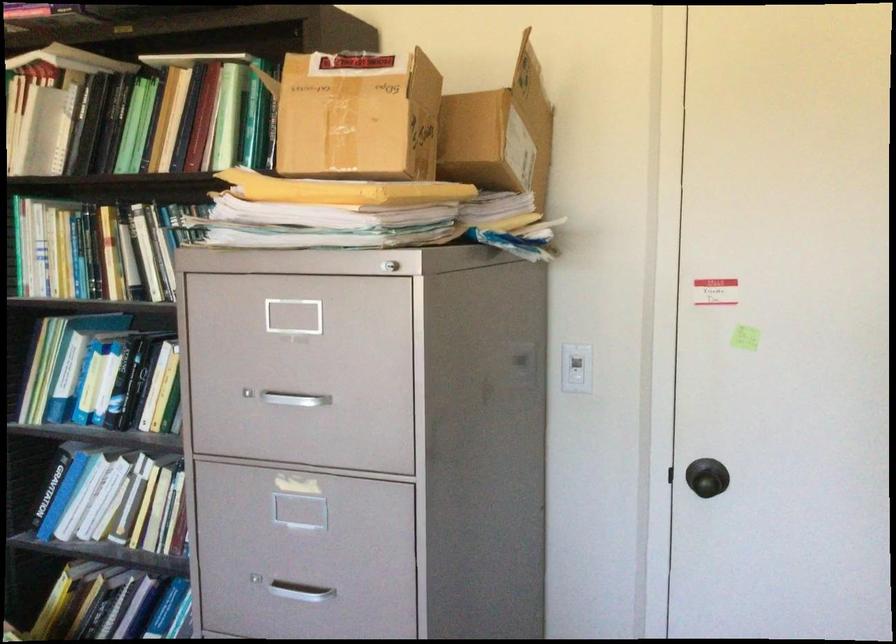
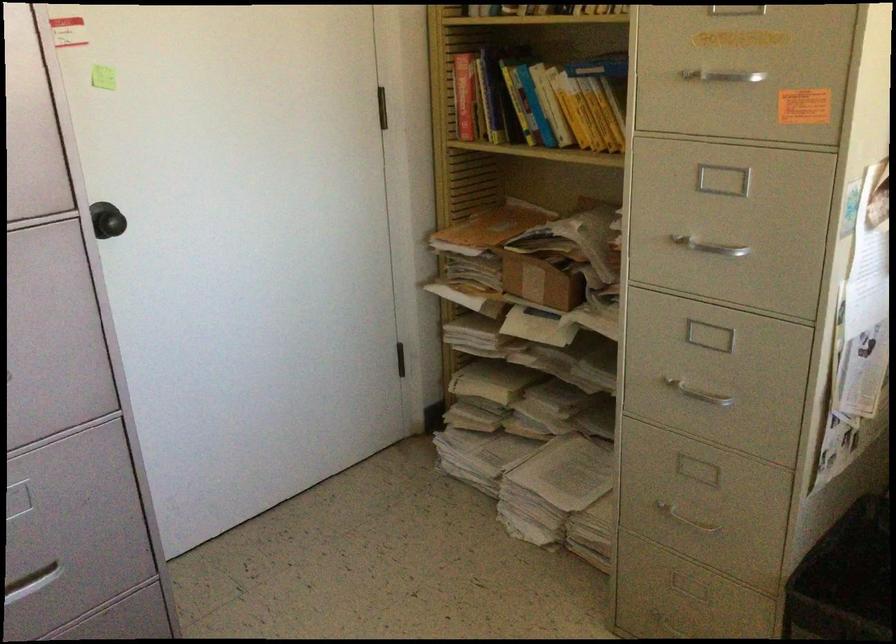
Locate, in the second image, the point that corresponds to (714,483) in the first image.

(115, 223)